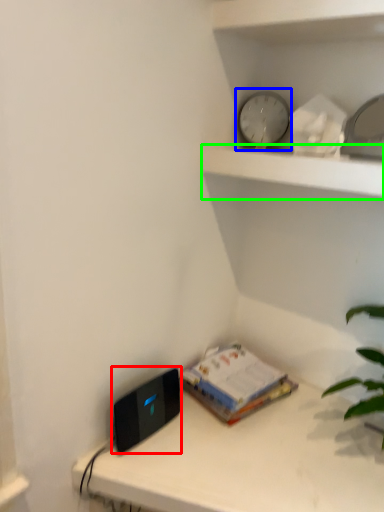
Question: Which is nearer to the ipod (highlighted by a red box)? clock (highlighted by a blue box) or shelf (highlighted by a green box).

Choices:
 (A) clock
 (B) shelf

Answer: (B)